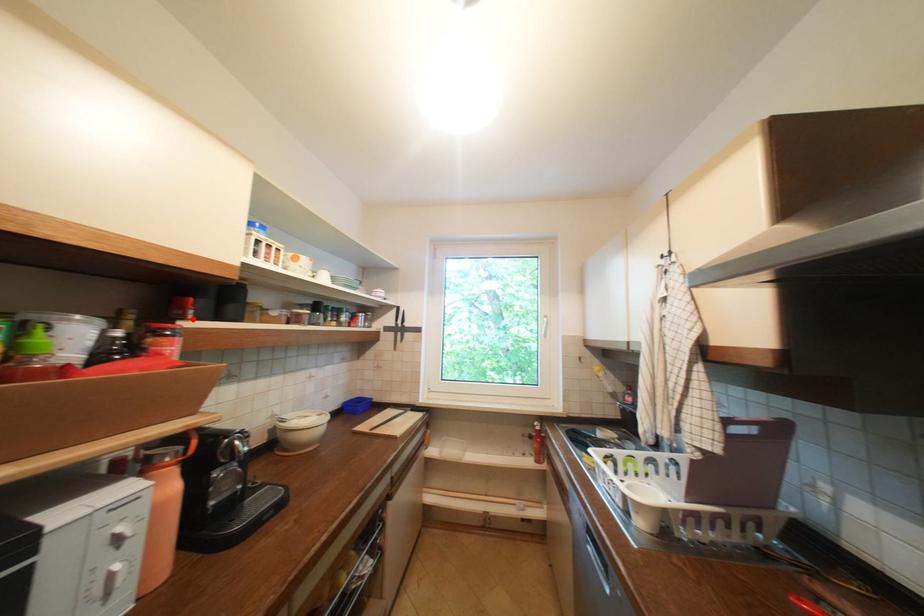
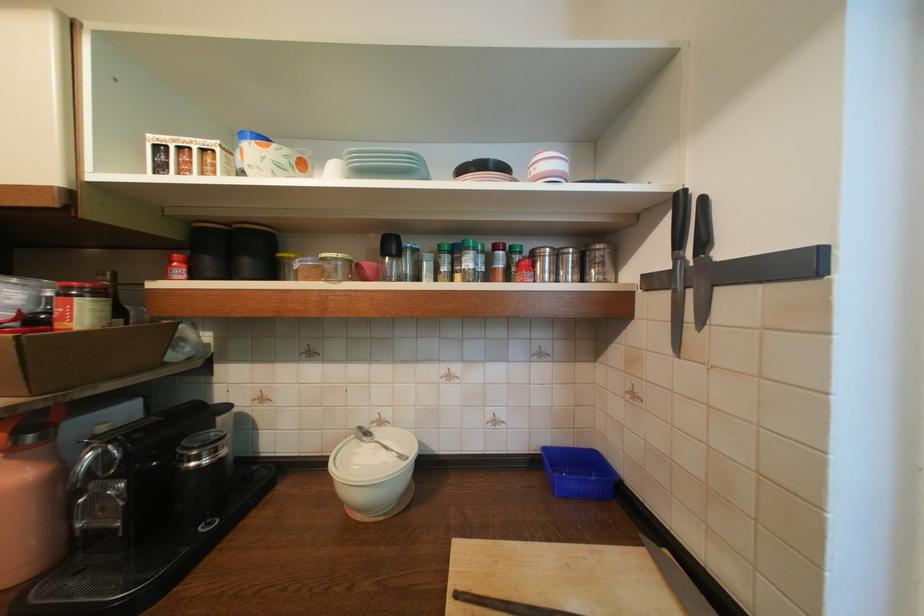
Locate, in the second image, the point that corresponds to the highlighted location in the first image.

(174, 278)